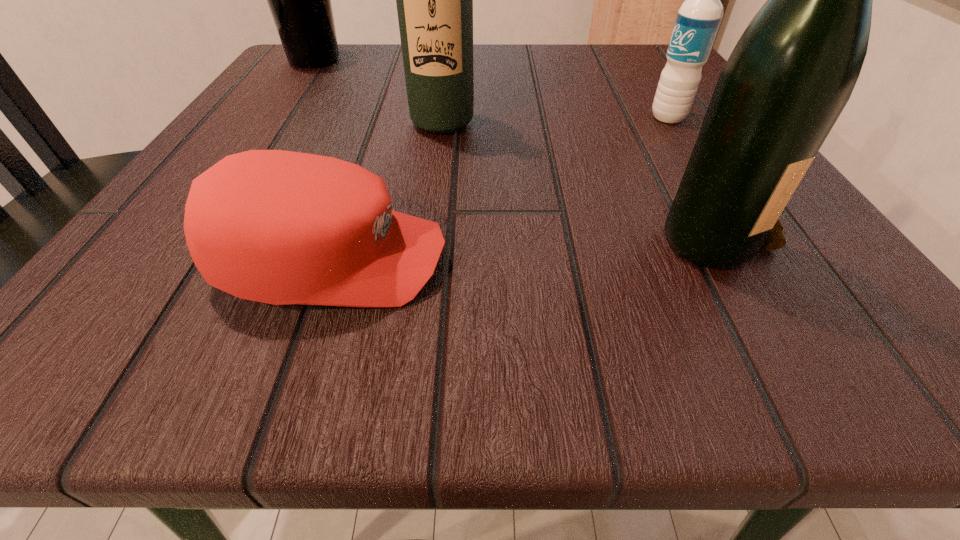
Find the location of a particular element. This screenshot has height=540, width=960. object that is at the near left corner is located at coordinates (279, 227).

I want to click on vacant space at the far edge, so click(x=560, y=91).

Locate an element on the screen. blank area at the near edge is located at coordinates (463, 321).

In the image, there is a desktop. At what (x,y) coordinates should I click in order to perform the action: click on free space at the left edge. Please return your answer as a coordinate pair (x, y). This screenshot has width=960, height=540. Looking at the image, I should click on (180, 197).

Find the location of a particular element. This screenshot has height=540, width=960. vacant space at the right edge of the desktop is located at coordinates (659, 172).

In the image, there is a desktop. Where is `vacant space at the far left corner`? The width and height of the screenshot is (960, 540). vacant space at the far left corner is located at coordinates (367, 57).

Identify the location of blank space at the far right corner of the desktop. Image resolution: width=960 pixels, height=540 pixels. (592, 52).

Find the location of a particular element. The height and width of the screenshot is (540, 960). empty space that is in between the farthest wine bottle and the water bottle is located at coordinates (492, 89).

You are a GUI agent. You are given a task and a screenshot of the screen. Output one action in this format:
    pyautogui.click(x=<x>, y=<y>)
    Task: Click on the vacant area between the second wine bottle from left to right and the leftmost wine bottle
    This screenshot has width=960, height=540.
    Given the screenshot: What is the action you would take?
    pyautogui.click(x=378, y=91)

Where is `blank region between the fourth tallest object and the second wine bottle from left to right`? blank region between the fourth tallest object and the second wine bottle from left to right is located at coordinates (555, 120).